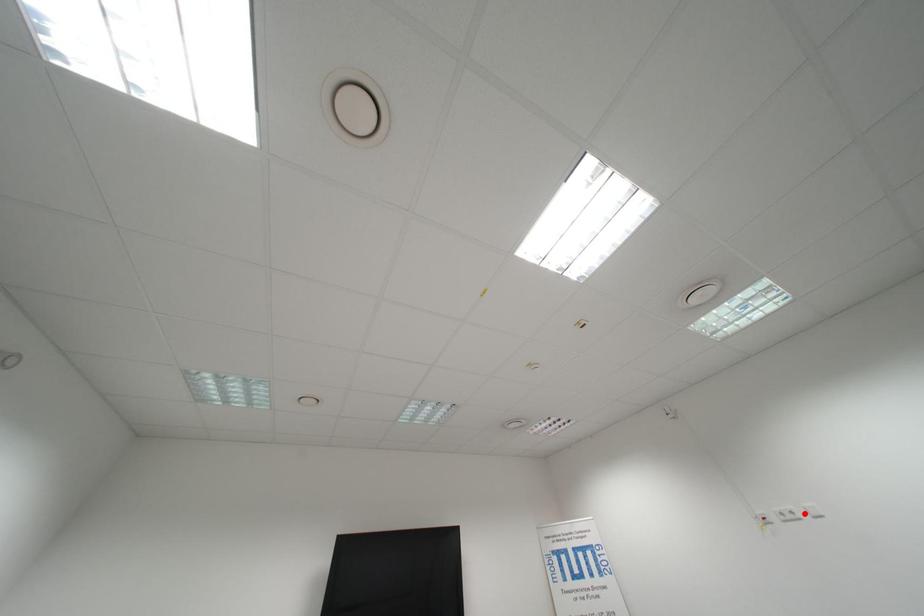
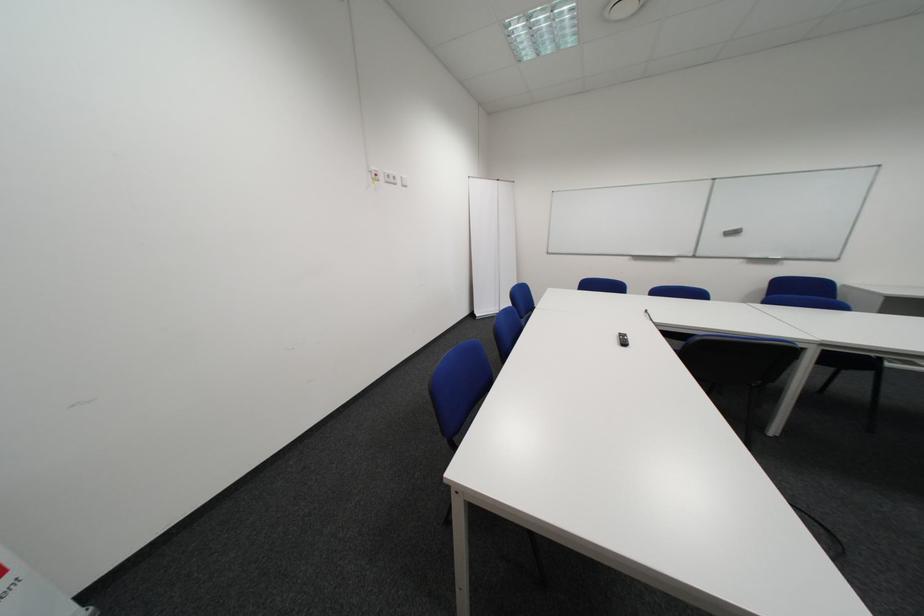
Locate, in the second image, the point that corresponds to the highlighted location in the first image.

(407, 179)